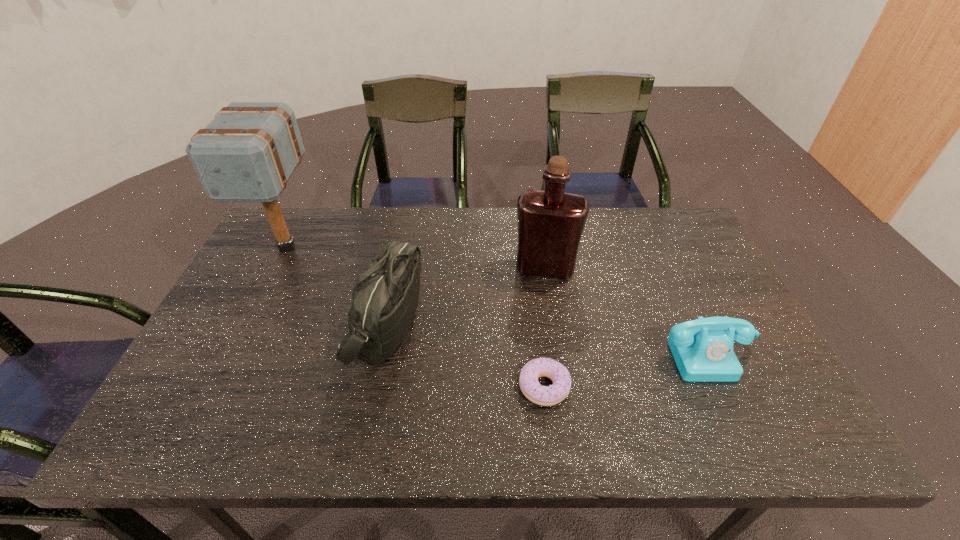
Select which object appears as the fourth closest to the doughnut. Please provide its 2D coordinates. Your answer should be formatted as a tuple, i.e. [(x, y)], where the tuple contains the x and y coordinates of a point satisfying the conditions above.

[(248, 152)]

Identify which object is located as the nearest to the leftmost object. Please provide its 2D coordinates. Your answer should be formatted as a tuple, i.e. [(x, y)], where the tuple contains the x and y coordinates of a point satisfying the conditions above.

[(385, 297)]

The image size is (960, 540). Identify the location of vacant space that satisfies the following two spatial constraints: 1. on the back side of the shortest object; 2. at the front padded panel of the third shortest object. pyautogui.click(x=537, y=325).